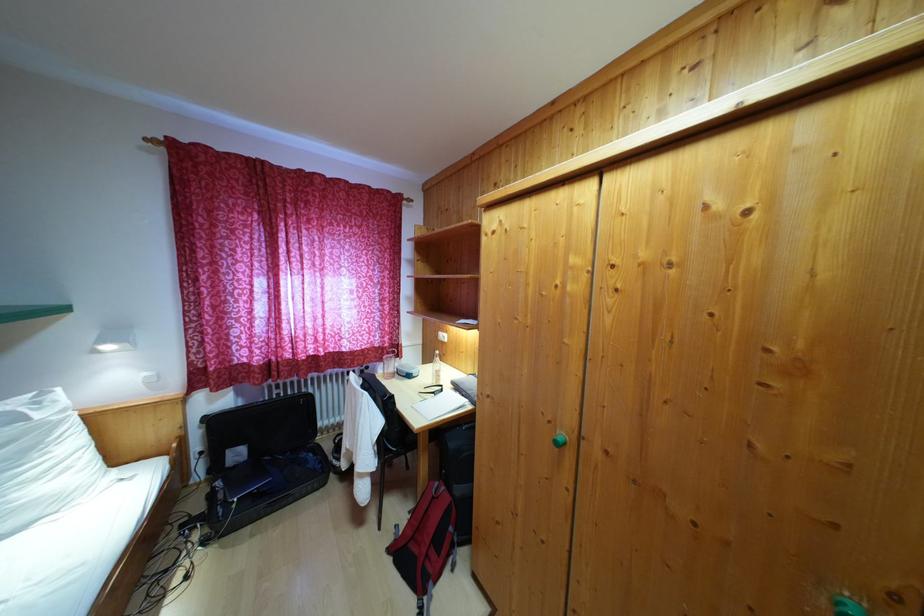
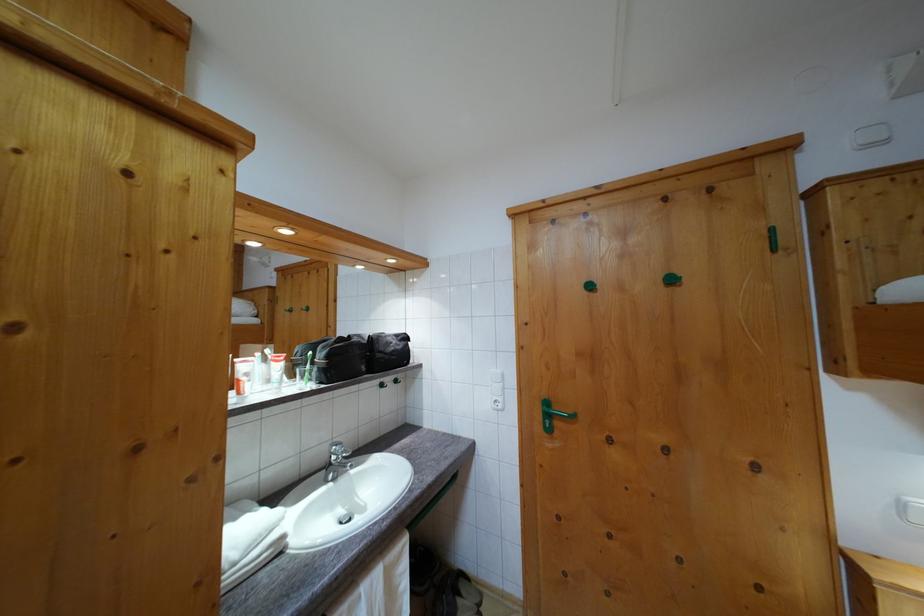
Question: Based on the continuous images, in which direction is the camera rotating? Reply with the corresponding letter.

Choices:
 (A) Left
 (B) Right
 (C) Up
 (D) Down

Answer: (B)